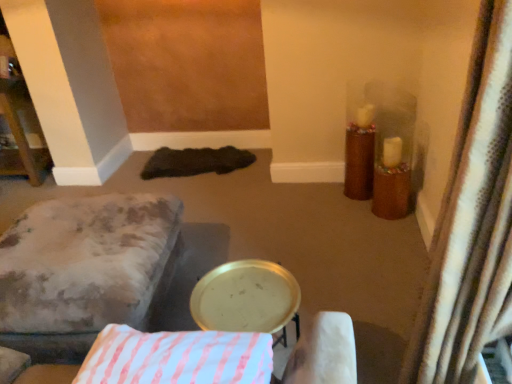
Locate an element on the screen. The image size is (512, 384). white striped fabric pillow at center is located at coordinates (177, 357).

Locate an element on the screen. This screenshot has width=512, height=384. velvet-like beige ottoman at lower left is located at coordinates (84, 271).

Which of these two, gold metallic tray at center or velvet-like beige ottoman at lower left, is smaller?

gold metallic tray at center.

What are the coordinates of `furniture that appears on the left of gold metallic tray at center` in the screenshot? It's located at (84, 271).

Can you confirm if gold metallic tray at center is positioned to the right of velvet-like beige ottoman at lower left?

Yes.

From a real-world perspective, is gold metallic tray at center under velvet-like beige ottoman at lower left?

Incorrect, from a real-world perspective, gold metallic tray at center is higher than velvet-like beige ottoman at lower left.

Which object is positioned more to the right, gold metallic tray at center or white textured curtain at right?

white textured curtain at right.

From the image's perspective, which object appears higher, gold metallic tray at center or white textured curtain at right?

From the image's view, white textured curtain at right is above.

Is gold metallic tray at center thinner than white textured curtain at right?

In fact, gold metallic tray at center might be wider than white textured curtain at right.

Measure the distance from gold metallic tray at center to white textured curtain at right.

The distance of gold metallic tray at center from white textured curtain at right is 24.84 inches.

Is white striped fabric pillow at center in contact with gold metallic tray at center?

white striped fabric pillow at center and gold metallic tray at center are not in contact.

Is white striped fabric pillow at center taller than gold metallic tray at center?

Incorrect, the height of white striped fabric pillow at center is not larger of that of gold metallic tray at center.

The image size is (512, 384). What are the coordinates of `round table behind the white striped fabric pillow at center` in the screenshot? It's located at (246, 298).

From the image's perspective, does white striped fabric pillow at center appear higher than gold metallic tray at center?

Yes, from the image's perspective, white striped fabric pillow at center is on top of gold metallic tray at center.

Is point (39, 267) in front of point (159, 355)?

No, it is behind (159, 355).

Is white striped fabric pillow at center completely or partially inside velvet-like beige ottoman at lower left?

Actually, white striped fabric pillow at center is outside velvet-like beige ottoman at lower left.

In the scene shown: Who is smaller, velvet-like beige ottoman at lower left or white striped fabric pillow at center?

white striped fabric pillow at center.

From the image's perspective, is white textured curtain at right above or below velvet-like beige ottoman at lower left?

Clearly, from the image's perspective, white textured curtain at right is above velvet-like beige ottoman at lower left.

What's the angular difference between white textured curtain at right and velvet-like beige ottoman at lower left's facing directions?

The angle between the facing direction of white textured curtain at right and the facing direction of velvet-like beige ottoman at lower left is 80 degrees.

Between white textured curtain at right and velvet-like beige ottoman at lower left, which one has larger size?

velvet-like beige ottoman at lower left is bigger.

Can you confirm if white textured curtain at right is taller than velvet-like beige ottoman at lower left?

Correct, white textured curtain at right is much taller as velvet-like beige ottoman at lower left.

Is white textured curtain at right oriented away from gold metallic tray at center?

No, gold metallic tray at center is not at the back of white textured curtain at right.

Are white textured curtain at right and gold metallic tray at center far apart?

They are positioned close to each other.

From a real-world perspective, who is located higher, white textured curtain at right or gold metallic tray at center?

In real-world perspective, white textured curtain at right is above.

From the image's perspective, is white textured curtain at right on top of gold metallic tray at center?

Yes, from the image's perspective, white textured curtain at right is over gold metallic tray at center.

What's the angular difference between white textured curtain at right and white striped fabric pillow at center's facing directions?

The angle between the facing direction of white textured curtain at right and the facing direction of white striped fabric pillow at center is 5.85 degrees.

Considering the points (421, 335) and (203, 363), which point is behind, point (421, 335) or point (203, 363)?

The point (421, 335) is behind.

Where is `pillow directly beneath the white textured curtain at right (from a real-world perspective)`? The width and height of the screenshot is (512, 384). pillow directly beneath the white textured curtain at right (from a real-world perspective) is located at coordinates (177, 357).

Looking at this image, could you tell me if white textured curtain at right is facing white striped fabric pillow at center?

Yes, white textured curtain at right is facing white striped fabric pillow at center.

Identify the location of furniture directly beneath the gold metallic tray at center (from a real-world perspective). The height and width of the screenshot is (384, 512). (84, 271).

In order to click on round table on the left of the white textured curtain at right in this screenshot , I will do `click(246, 298)`.

Looking at the image, which one is located further to gold metallic tray at center, white textured curtain at right or velvet-like beige ottoman at lower left?

The object further to gold metallic tray at center is white textured curtain at right.

From the image, which object appears to be farther from gold metallic tray at center, white striped fabric pillow at center or velvet-like beige ottoman at lower left?

Based on the image, velvet-like beige ottoman at lower left appears to be further to gold metallic tray at center.

From the image, which object appears to be farther from white textured curtain at right, gold metallic tray at center or white striped fabric pillow at center?

Based on the image, white striped fabric pillow at center appears to be further to white textured curtain at right.

Looking at the image, which one is located further to gold metallic tray at center, white striped fabric pillow at center or white textured curtain at right?

The object further to gold metallic tray at center is white textured curtain at right.

Looking at the image, which one is located closer to white striped fabric pillow at center, white textured curtain at right or gold metallic tray at center?

gold metallic tray at center is positioned closer to the anchor white striped fabric pillow at center.

Looking at this image, when comparing their distances from velvet-like beige ottoman at lower left, does white textured curtain at right or white striped fabric pillow at center seem further?

Among the two, white textured curtain at right is located further to velvet-like beige ottoman at lower left.

When comparing their distances from white striped fabric pillow at center, does velvet-like beige ottoman at lower left or white textured curtain at right seem further?

velvet-like beige ottoman at lower left.

Considering their positions, is velvet-like beige ottoman at lower left positioned closer to white textured curtain at right than white striped fabric pillow at center?

white striped fabric pillow at center lies closer to white textured curtain at right than the other object.

Identify the location of round table between white striped fabric pillow at center and white textured curtain at right in the horizontal direction. (246, 298).

Find the location of a particular element. The width and height of the screenshot is (512, 384). pillow between velvet-like beige ottoman at lower left and gold metallic tray at center in the horizontal direction is located at coordinates (177, 357).

You are a GUI agent. You are given a task and a screenshot of the screen. Output one action in this format:
    pyautogui.click(x=<x>, y=<y>)
    Task: Click on the pillow between velvet-like beige ottoman at lower left and white textured curtain at right from left to right
    
    Given the screenshot: What is the action you would take?
    pyautogui.click(x=177, y=357)

Where is `round table situated between velvet-like beige ottoman at lower left and white textured curtain at right from left to right`? round table situated between velvet-like beige ottoman at lower left and white textured curtain at right from left to right is located at coordinates [x=246, y=298].